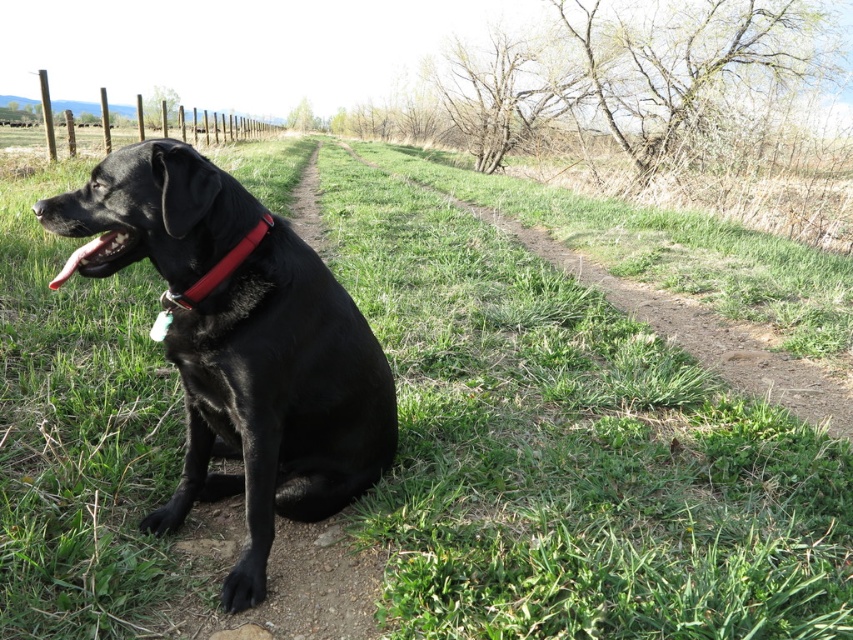
Question: Which of these objects is positioned farthest from the rubber/soft neckband at center?

Choices:
 (A) black rubber mouth at lower left
 (B) dirt path at center
 (C) shiny black dog at center

Answer: (B)

Question: Is dirt path at center wider than rubber/soft neckband at center?

Choices:
 (A) no
 (B) yes

Answer: (B)

Question: Which point is farther to the camera?

Choices:
 (A) (247, 256)
 (B) (798, 376)
 (C) (235, 214)
 (D) (56, 285)

Answer: (B)

Question: Considering the real-world distances, which object is closest to the rubber/soft neckband at center?

Choices:
 (A) shiny black dog at center
 (B) black rubber mouth at lower left
 (C) dirt path at center

Answer: (B)

Question: Can you confirm if rubber/soft neckband at center is positioned below black rubber mouth at lower left?

Choices:
 (A) yes
 (B) no

Answer: (A)

Question: Does shiny black dog at center appear over dirt path at center?

Choices:
 (A) no
 (B) yes

Answer: (A)